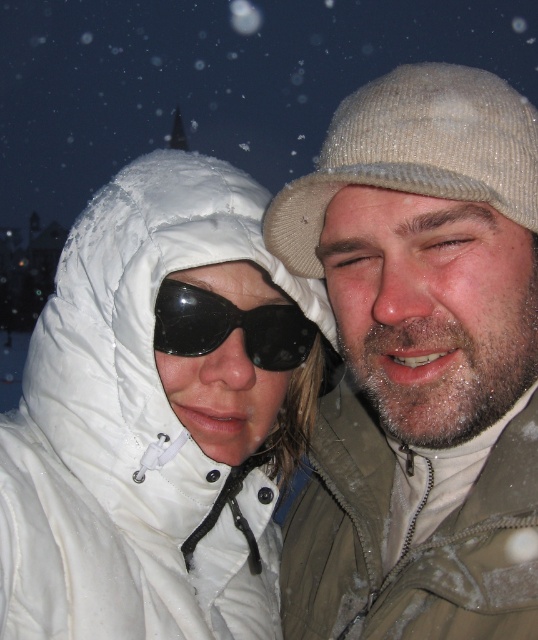
Question: Does white puffy coat at center have a smaller size compared to black matte sunglasses at center?

Choices:
 (A) yes
 (B) no

Answer: (B)

Question: Estimate the real-world distances between objects in this image. Which object is farther from the fuzzy beige knit cap at upper right?

Choices:
 (A) black matte sunglasses at center
 (B) white puffy coat at center

Answer: (B)

Question: Which of these objects is positioned farthest from the fuzzy beige knit cap at upper right?

Choices:
 (A) white puffy coat at center
 (B) black matte sunglasses at center

Answer: (A)

Question: Which object is the closest to the black matte sunglasses at center?

Choices:
 (A) fuzzy beige knit cap at upper right
 (B) white puffy coat at center

Answer: (B)

Question: Is white puffy coat at center behind black matte sunglasses at center?

Choices:
 (A) yes
 (B) no

Answer: (B)

Question: Does fuzzy beige knit cap at upper right come behind black matte sunglasses at center?

Choices:
 (A) yes
 (B) no

Answer: (B)